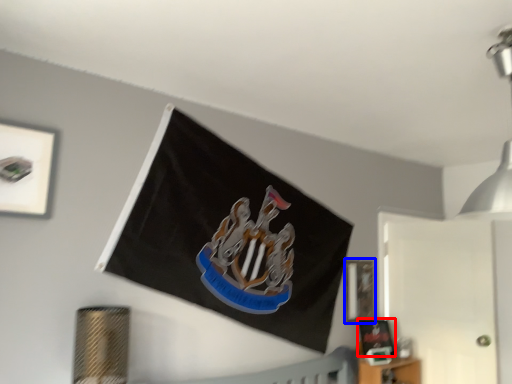
Question: Which object appears farthest to the camera in this image, picture frame (highlighted by a red box) or picture frame (highlighted by a blue box)?

Choices:
 (A) picture frame
 (B) picture frame

Answer: (B)